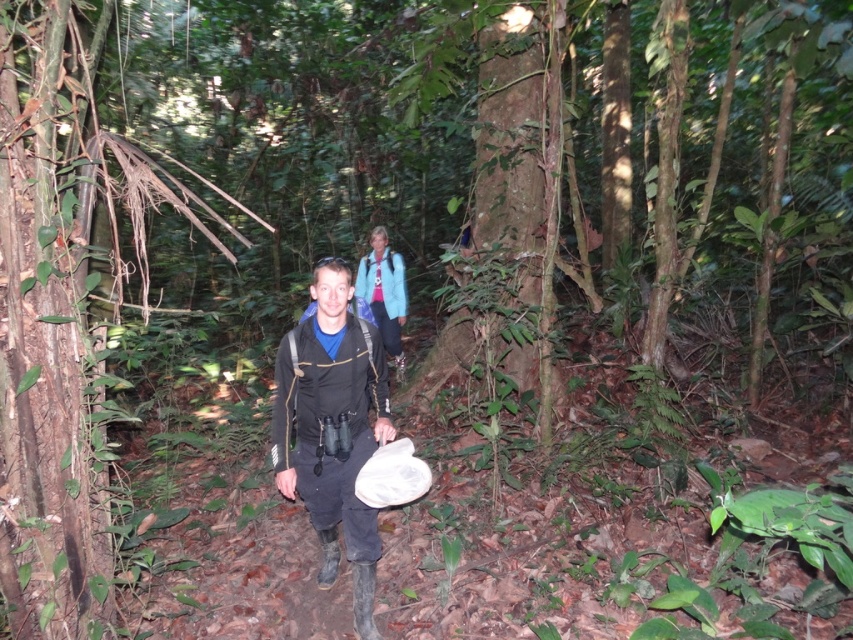
You are a hiker in the forest and see the matte black jacket at center and the blue fabric jacket at upper center. Which jacket is closer to you?

The matte black jacket at center is closer to you because it is positioned under the blue fabric jacket at upper center, indicating it is in front.

You are an observer in the forest scene. You notice two jackets in the image. The matte black jacket at center and the blue fabric jacket at upper center. Which one appears bigger in size?

The matte black jacket at center appears bigger in size compared to the blue fabric jacket at upper center.